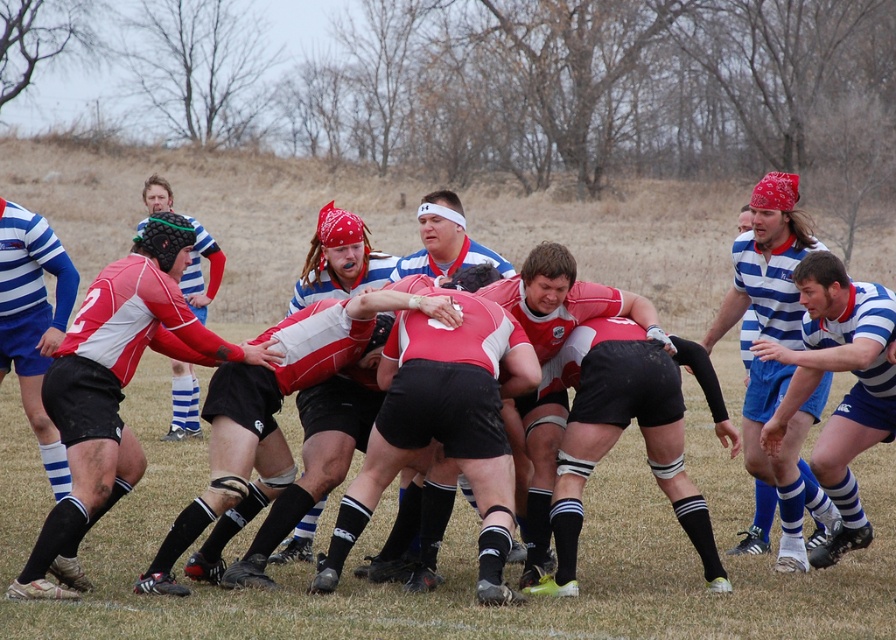
Question: Which of these objects is positioned farthest from the blue striped jersey at right?

Choices:
 (A) blue striped jersey at center
 (B) matte red jersey at center

Answer: (B)

Question: Can you confirm if blue striped jersey at center is wider than matte red jersey at center?

Choices:
 (A) yes
 (B) no

Answer: (A)

Question: Which point is closer to the camera?

Choices:
 (A) tap(153, 196)
 (B) tap(883, 323)

Answer: (B)

Question: Can you confirm if blue striped jersey at right is positioned to the right of matte red jersey at center?

Choices:
 (A) yes
 (B) no

Answer: (A)

Question: Which of these objects is positioned closest to the blue striped jersey at right?

Choices:
 (A) matte red jersey at center
 (B) blue striped jersey at center

Answer: (B)

Question: Does blue striped jersey at center appear under matte red jersey at center?

Choices:
 (A) yes
 (B) no

Answer: (A)